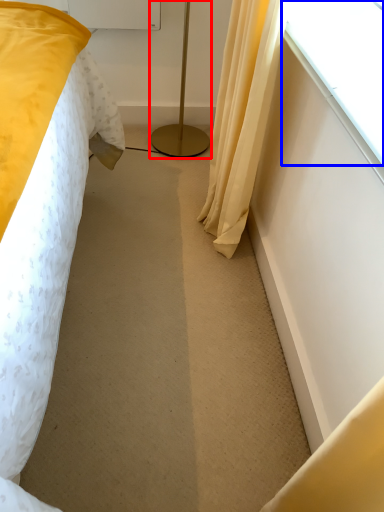
Question: Which point is further to the camera, lamp (highlighted by a red box) or window (highlighted by a blue box)?

Choices:
 (A) lamp
 (B) window

Answer: (A)